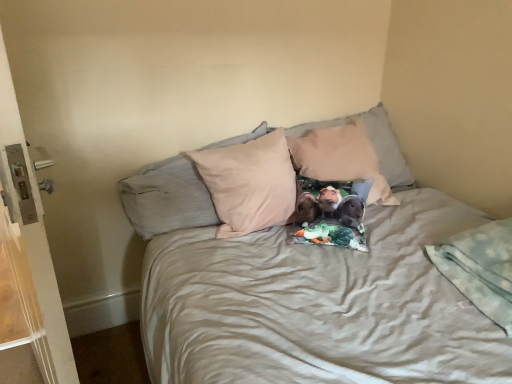
Question: Considering the positions of white plastic screen door at left and beige fabric pillow at center, which appears as the second pillow when viewed from the right, in the image, is white plastic screen door at left bigger or smaller than beige fabric pillow at center, which appears as the second pillow when viewed from the right,?

Choices:
 (A) small
 (B) big

Answer: (B)

Question: Considering the positions of white plastic screen door at left and beige fabric pillow at center, which appears as the second pillow when viewed from the right, in the image, is white plastic screen door at left taller or shorter than beige fabric pillow at center, which appears as the second pillow when viewed from the right,?

Choices:
 (A) short
 (B) tall

Answer: (B)

Question: Estimate the real-world distances between objects in this image. Which object is closer to the beige fabric pillow at center, positioned as the first pillow in left-to-right order?

Choices:
 (A) beige fabric pillow at center, the 2th pillow from the left
 (B) white plastic screen door at left
 (C) light blue fleece blanket at lower right

Answer: (A)

Question: Which object is the farthest from the light blue fleece blanket at lower right?

Choices:
 (A) beige fabric pillow at center, which appears as the second pillow when viewed from the right
 (B) beige fabric pillow at center, the first pillow when ordered from right to left
 (C) white plastic screen door at left

Answer: (C)